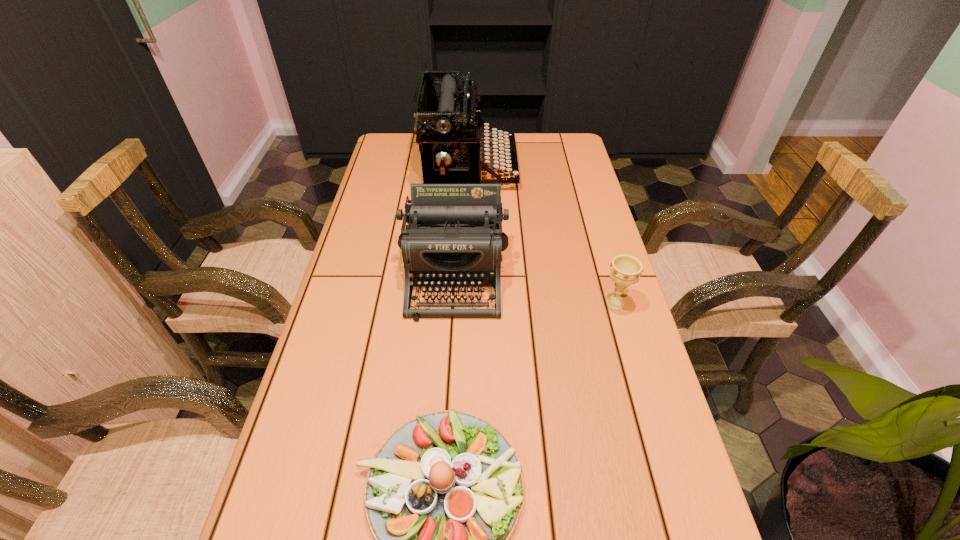
Identify the location of free space that satisfies the following two spatial constraints: 1. on the typing side of the taller typewriter; 2. on the left side of the rightmost object. Image resolution: width=960 pixels, height=540 pixels. (466, 304).

Where is `free space that satisfies the following two spatial constraints: 1. on the typing side of the farthest object; 2. on the keyboard of the nearer typewriter`? The image size is (960, 540). free space that satisfies the following two spatial constraints: 1. on the typing side of the farthest object; 2. on the keyboard of the nearer typewriter is located at coordinates (467, 273).

What are the coordinates of `vacant position in the image that satisfies the following two spatial constraints: 1. on the typing side of the farther typewriter; 2. on the keyboard of the shorter typewriter` in the screenshot? It's located at tap(467, 273).